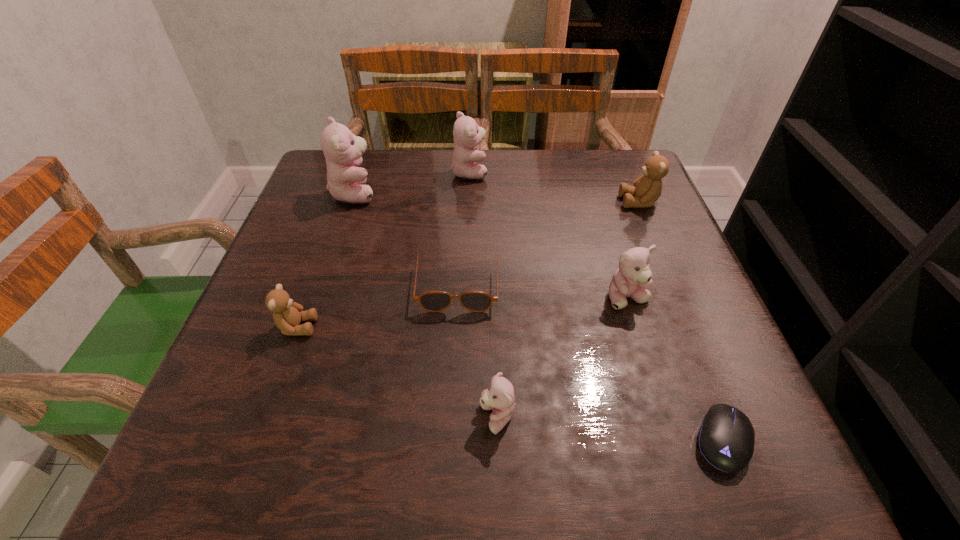
The width and height of the screenshot is (960, 540). Identify the location of the smallest pink teddy bear. (499, 397).

The height and width of the screenshot is (540, 960). Find the location of `the nearest pink teddy bear`. the nearest pink teddy bear is located at coordinates (499, 397).

Find the location of a particular element. the second shortest object is located at coordinates (432, 301).

This screenshot has height=540, width=960. What are the coordinates of `brown sunglasses` in the screenshot? It's located at (432, 301).

The image size is (960, 540). In order to click on computer mouse in this screenshot , I will do 726,437.

Where is `black computer mouse`? The height and width of the screenshot is (540, 960). black computer mouse is located at coordinates (726, 437).

Locate an element on the screen. vacant space positioned 0.210m at the face of the leftmost pink teddy bear is located at coordinates click(464, 193).

At what (x,y) coordinates should I click in order to perform the action: click on free space located 0.060m at the face of the third smallest pink teddy bear. Please return your answer as a coordinate pair (x, y). Image resolution: width=960 pixels, height=540 pixels. Looking at the image, I should click on (511, 172).

You are a GUI agent. You are given a task and a screenshot of the screen. Output one action in this format:
    pyautogui.click(x=<x>, y=<y>)
    Task: Click on the vacant space situated 0.320m on the face of the farther brown teddy bear
    
    Given the screenshot: What is the action you would take?
    pyautogui.click(x=485, y=202)

Where is `vacant point located 0.390m on the face of the farther brown teddy bear`? vacant point located 0.390m on the face of the farther brown teddy bear is located at coordinates (455, 202).